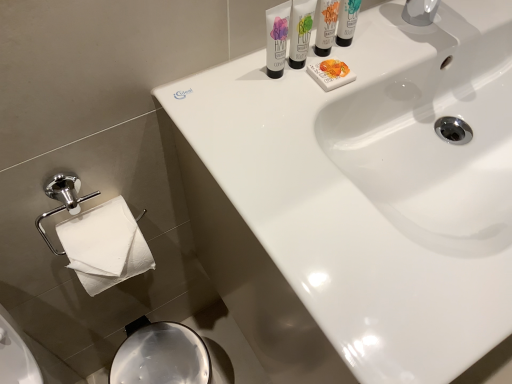
At what (x,y) coordinates should I click in order to perform the action: click on blank space to the left of matte white shaving cream at upper center, the 2th shaving cream viewed from the left. Please return your answer as a coordinate pair (x, y). Looking at the image, I should click on (221, 86).